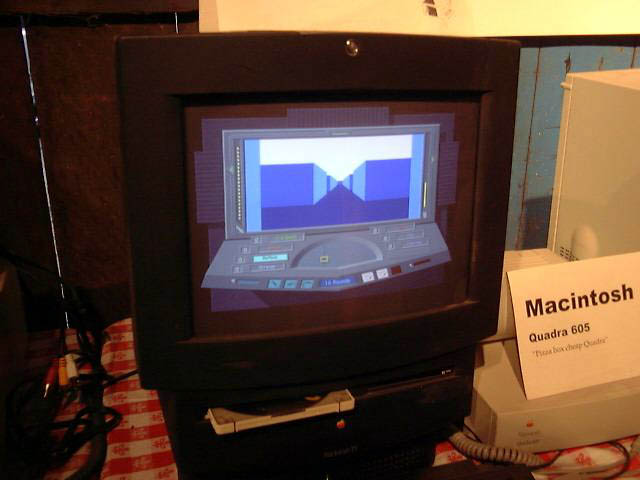
Locate an element on the screen. cords is located at coordinates (70, 439), (42, 408), (31, 408), (93, 357), (617, 460).